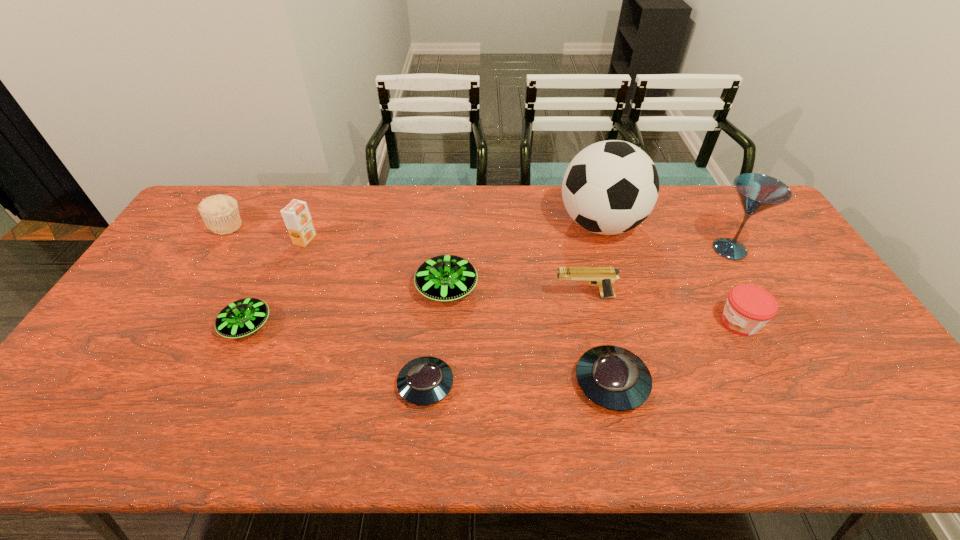
In the image, there is a desktop. At what (x,y) coordinates should I click in order to perform the action: click on free space at the near right corner. Please return your answer as a coordinate pair (x, y). This screenshot has width=960, height=540. Looking at the image, I should click on (919, 447).

In order to click on free space that is in between the beige muffin and the left gray saucer in this screenshot , I will do `click(326, 305)`.

Where is `empty space between the soccer ball and the pistol`? This screenshot has width=960, height=540. empty space between the soccer ball and the pistol is located at coordinates (592, 260).

Identify the location of free area in between the pistol and the bigger green saucer. The width and height of the screenshot is (960, 540). (516, 292).

Locate an element on the screen. This screenshot has height=540, width=960. blank region between the left green saucer and the pistol is located at coordinates (416, 311).

Locate an element on the screen. The image size is (960, 540). free spot between the orange orange juice and the ninth shortest object is located at coordinates [x=517, y=245].

Locate an element on the screen. This screenshot has height=540, width=960. vacant point located between the red jam and the third tallest object is located at coordinates (522, 281).

You are a GUI agent. You are given a task and a screenshot of the screen. Output one action in this format:
    pyautogui.click(x=<x>, y=<y>)
    Task: Click on the free space between the pistol and the second tallest object
    Image resolution: width=960 pixels, height=540 pixels.
    Given the screenshot: What is the action you would take?
    pyautogui.click(x=657, y=273)

Locate an element on the screen. This screenshot has height=540, width=960. free spot between the red jam and the orange juice is located at coordinates (522, 281).

Find the location of `vacant space that's between the muffin and the right green saucer`. vacant space that's between the muffin and the right green saucer is located at coordinates (337, 256).